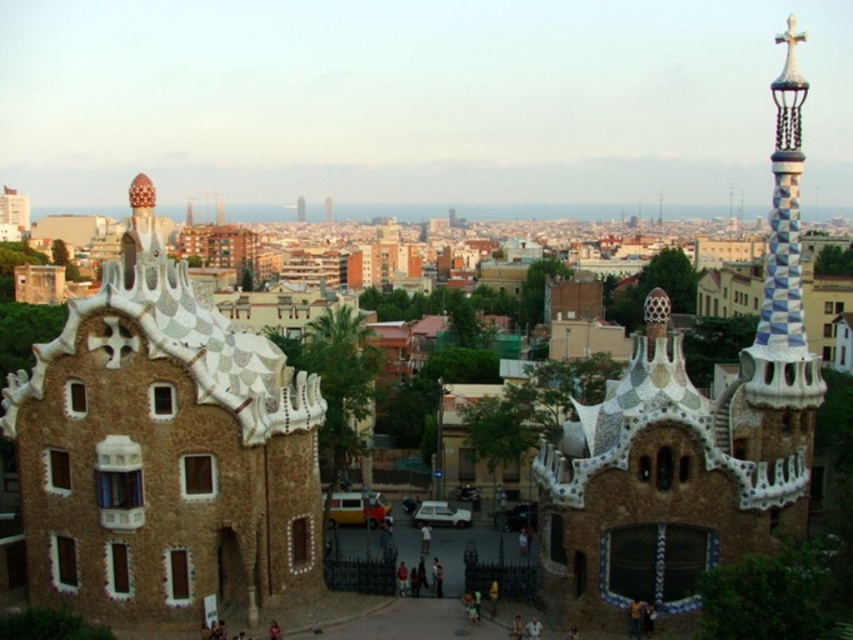
Does point (241, 353) come farther from viewer compared to point (746, 403)?

Yes, it is.

What do you see at coordinates (163, 451) in the screenshot? This screenshot has width=853, height=640. I see `brown textured stone tower at center-left` at bounding box center [163, 451].

Where is `brown textured stone tower at center-left`? The image size is (853, 640). brown textured stone tower at center-left is located at coordinates (163, 451).